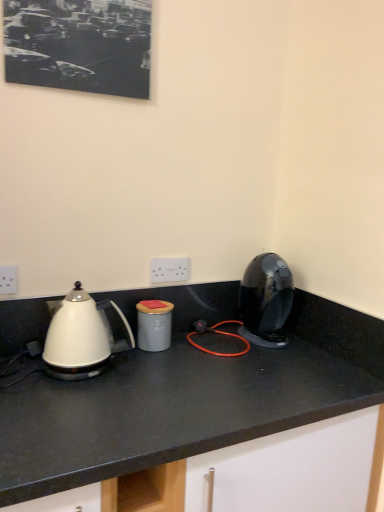
Question: Is gray matte canister at center in front of or behind white plastic electric outlet at left, the 2th electric outlet when ordered from back to front, in the image?

Choices:
 (A) behind
 (B) front

Answer: (A)

Question: Is gray matte canister at center wider or thinner than white plastic electric outlet at left, which is the 2th electric outlet from right to left?

Choices:
 (A) wide
 (B) thin

Answer: (A)

Question: Which object is the closest to the shiny black coffee machine at right?

Choices:
 (A) gray matte canister at center
 (B) white plastic electric outlet at center, which is the 2th electric outlet in left-to-right order
 (C) white glossy kettle at left
 (D) white glossy countertop at center
 (E) white plastic electric outlet at left, the 2th electric outlet when ordered from back to front

Answer: (D)

Question: Considering the real-world distances, which object is farthest from the gray matte canister at center?

Choices:
 (A) white glossy kettle at left
 (B) white plastic electric outlet at center, the second electric outlet positioned from the front
 (C) black matte picture frame at upper left
 (D) white plastic electric outlet at left, which is the 2th electric outlet from right to left
 (E) shiny black coffee machine at right

Answer: (C)